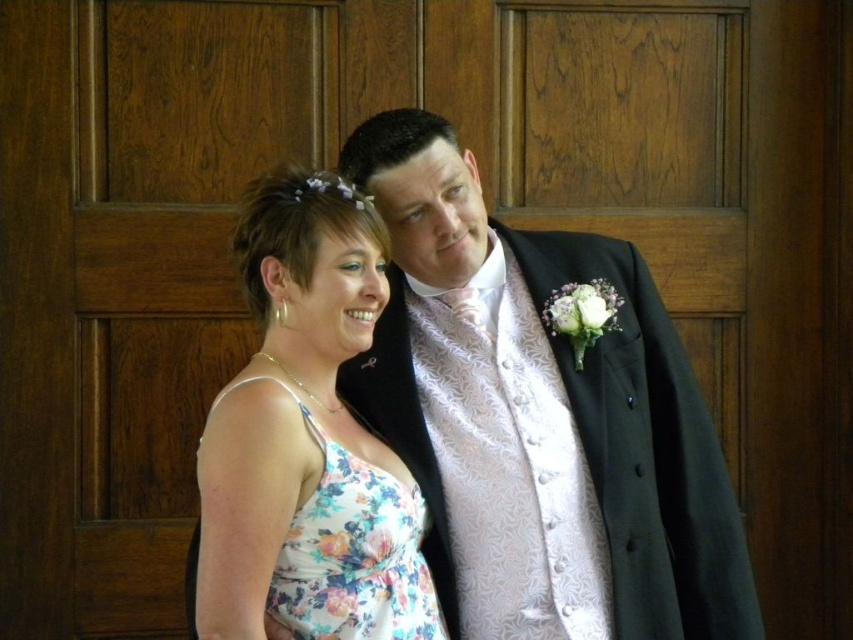
Is floral dress at center thinner than floral fabric dress at center?

Incorrect, floral dress at center's width is not less than floral fabric dress at center's.

Which is behind, point (488, 244) or point (375, 253)?

The point (488, 244) is behind.

Is point (671, 397) closer to viewer compared to point (258, 547)?

No.

Locate an element on the screen. floral dress at center is located at coordinates (538, 419).